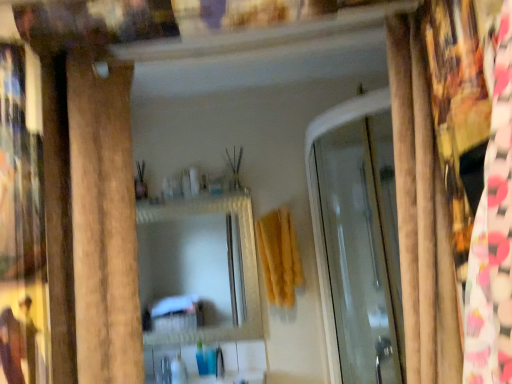
The width and height of the screenshot is (512, 384). Describe the element at coordinates (201, 360) in the screenshot. I see `blue plastic bottle at center` at that location.

This screenshot has width=512, height=384. In order to click on blue plastic bottle at center in this screenshot , I will do `click(201, 360)`.

What are the coordinates of `blue plastic bottle at center` in the screenshot? It's located at (201, 360).